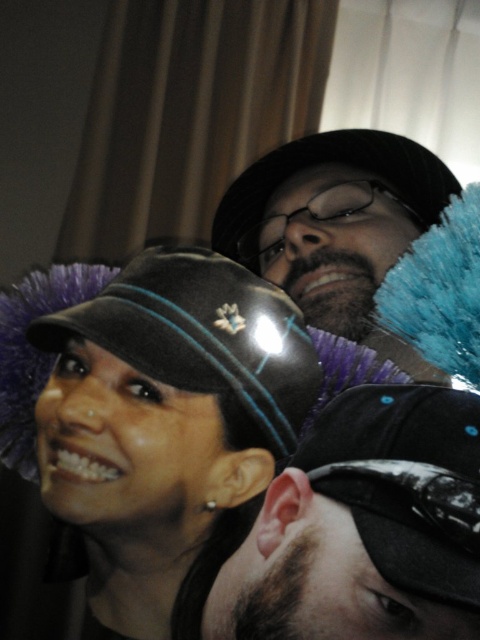
You are a photographer adjusting the camera focus. You need to focus on the black shiny cap at center and the matte black hat at center. Which one is lower in the frame?

The black shiny cap at center is below matte black hat at center, so it is lower in the frame.

You are a photographer adjusting the camera focus. You notice two black caps with blue feather decorations in the frame. Which one is more to the left? The matte black cap at center or the black shiny cap at center?

The matte black cap at center is more to the left side of the black shiny cap at center.